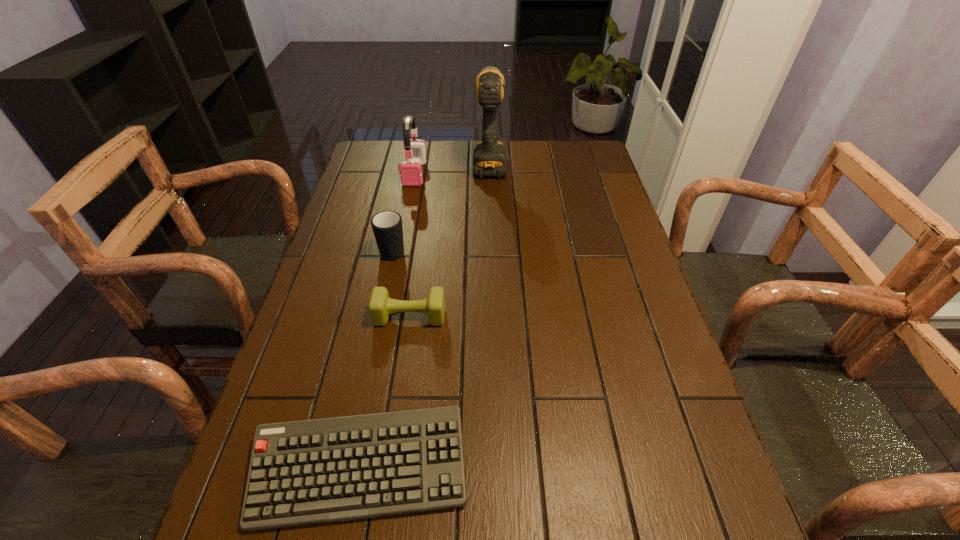
Point out which object is positioned as the fourth nearest to the third shortest object. Please provide its 2D coordinates. Your answer should be formatted as a tuple, i.e. [(x, y)], where the tuple contains the x and y coordinates of a point satisfying the conditions above.

[(305, 472)]